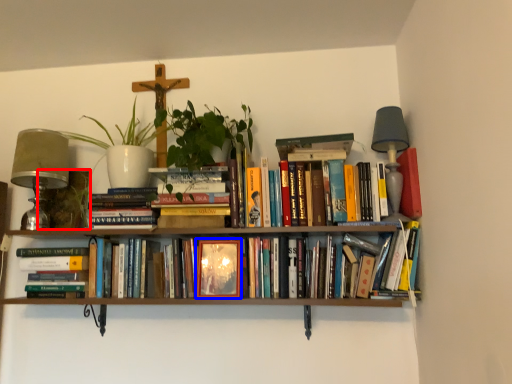
Question: Which point is further to the camera, plant (highlighted by a red box) or paperback book (highlighted by a blue box)?

Choices:
 (A) plant
 (B) paperback book

Answer: (A)